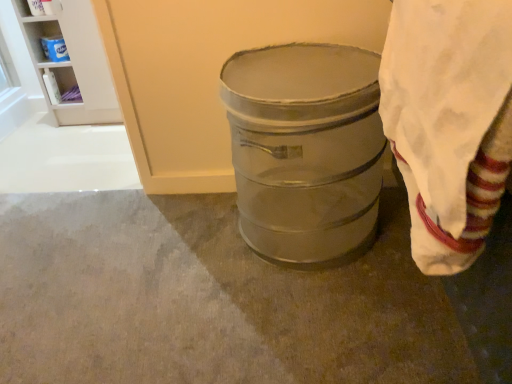
Question: From the image's perspective, is white plastic shelf at upper left, marked as the second shelf in a left-to-right arrangement, over metallic gray trash can at center?

Choices:
 (A) no
 (B) yes

Answer: (B)

Question: Does white plastic shelf at upper left, marked as the second shelf in a left-to-right arrangement, have a larger size compared to metallic gray trash can at center?

Choices:
 (A) no
 (B) yes

Answer: (A)

Question: Is white plastic shelf at upper left, which is counted as the first shelf, starting from the right, facing away from metallic gray trash can at center?

Choices:
 (A) yes
 (B) no

Answer: (B)

Question: From a real-world perspective, is white plastic shelf at upper left, which is counted as the first shelf, starting from the right, beneath metallic gray trash can at center?

Choices:
 (A) yes
 (B) no

Answer: (B)

Question: Considering the relative sizes of white plastic shelf at upper left, marked as the second shelf in a left-to-right arrangement, and metallic gray trash can at center in the image provided, is white plastic shelf at upper left, marked as the second shelf in a left-to-right arrangement, wider than metallic gray trash can at center?

Choices:
 (A) no
 (B) yes

Answer: (A)

Question: Considering the positions of white glossy shelf at upper left, positioned as the second shelf in right-to-left order, and metallic gray trash can at center in the image, is white glossy shelf at upper left, positioned as the second shelf in right-to-left order, taller or shorter than metallic gray trash can at center?

Choices:
 (A) tall
 (B) short

Answer: (B)

Question: From the image's perspective, is white glossy shelf at upper left, positioned as the second shelf in right-to-left order, positioned above or below metallic gray trash can at center?

Choices:
 (A) above
 (B) below

Answer: (A)

Question: Is white glossy shelf at upper left, which is counted as the first shelf, starting from the left, bigger or smaller than metallic gray trash can at center?

Choices:
 (A) big
 (B) small

Answer: (B)

Question: Does point (48, 76) appear closer or farther from the camera than point (327, 124)?

Choices:
 (A) farther
 (B) closer

Answer: (A)

Question: Based on their sizes in the image, would you say metallic gray barrel at center is bigger or smaller than white plastic shelf at upper left, which is counted as the first shelf, starting from the right?

Choices:
 (A) big
 (B) small

Answer: (B)

Question: From a real-world perspective, relative to white plastic shelf at upper left, which is counted as the first shelf, starting from the right, is metallic gray barrel at center vertically above or below?

Choices:
 (A) above
 (B) below

Answer: (B)

Question: Considering the positions of metallic gray barrel at center and white plastic shelf at upper left, which is counted as the first shelf, starting from the right, in the image, is metallic gray barrel at center taller or shorter than white plastic shelf at upper left, which is counted as the first shelf, starting from the right,?

Choices:
 (A) tall
 (B) short

Answer: (B)

Question: Based on their positions, is metallic gray barrel at center located to the left or right of white plastic shelf at upper left, which is counted as the first shelf, starting from the right?

Choices:
 (A) right
 (B) left

Answer: (A)

Question: Would you say metallic gray trash can at center is inside or outside white plastic shelf at upper left, marked as the second shelf in a left-to-right arrangement?

Choices:
 (A) inside
 (B) outside

Answer: (B)

Question: From a real-world perspective, is metallic gray trash can at center physically located above or below white plastic shelf at upper left, marked as the second shelf in a left-to-right arrangement?

Choices:
 (A) below
 (B) above

Answer: (A)